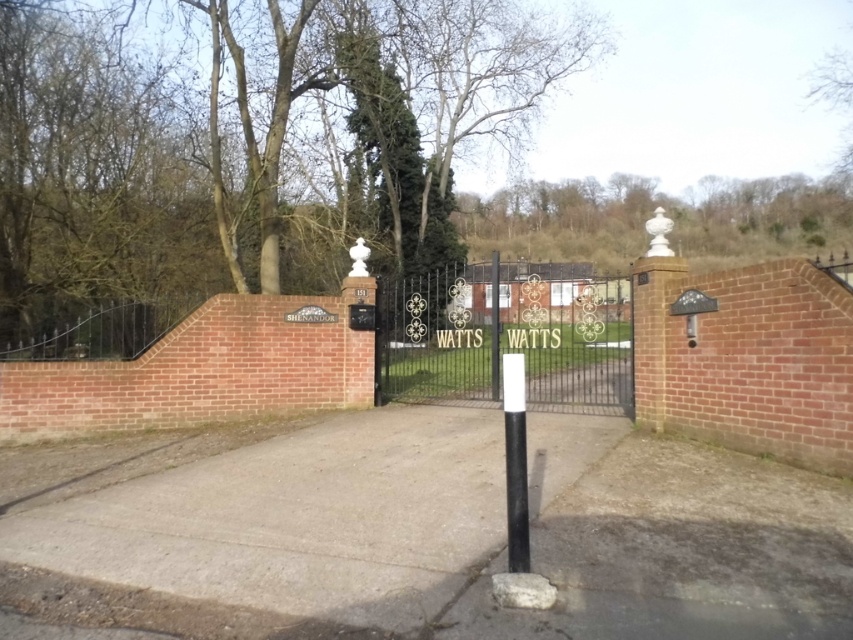
Locate an element on the screen. This screenshot has width=853, height=640. black matte pole at center is located at coordinates click(x=515, y=461).

Between point (525, 476) and point (492, 298), which one is positioned in front?

Point (525, 476) is in front.

Who is more forward, (x=514, y=477) or (x=490, y=337)?

Point (x=514, y=477) is in front.

Identify the location of black matte pole at center. (515, 461).

Locate an element on the screen. black wrought iron gate at center is located at coordinates (567, 332).

Based on the photo, measure the distance from black wrought iron gate at center to black matte pole at center.

black wrought iron gate at center and black matte pole at center are 10.09 meters apart from each other.

Who is more forward, (x=544, y=346) or (x=517, y=506)?

Positioned in front is point (x=517, y=506).

The image size is (853, 640). In order to click on black wrought iron gate at center in this screenshot , I will do `click(567, 332)`.

Can you confirm if black wrought iron gate at center is positioned to the left of white glossy pole at center?

In fact, black wrought iron gate at center is to the right of white glossy pole at center.

Which is above, black wrought iron gate at center or white glossy pole at center?

white glossy pole at center is higher up.

At what (x,y) coordinates should I click in order to perform the action: click on black wrought iron gate at center. Please return your answer as a coordinate pair (x, y). The width and height of the screenshot is (853, 640). Looking at the image, I should click on (567, 332).

The image size is (853, 640). In order to click on black wrought iron gate at center in this screenshot , I will do [567, 332].